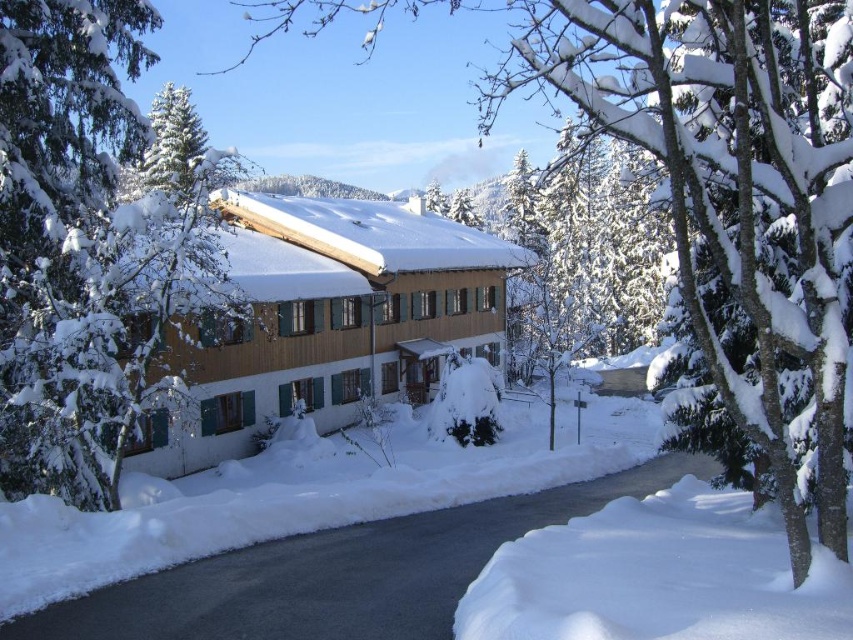
Is snow-covered tree at center behind white fluffy snow at lower right?

Yes, it is behind white fluffy snow at lower right.

Between snow-covered tree at center and white fluffy snow at lower right, which one has less height?

Standing shorter between the two is white fluffy snow at lower right.

Is point (720, 58) more distant than point (741, 509)?

No, it is in front of (741, 509).

Find the location of `snow-covered tree at center`. snow-covered tree at center is located at coordinates (727, 193).

Between point (126, 365) and point (711, 516), which one is positioned in front?

Point (711, 516) is in front.

This screenshot has height=640, width=853. Identify the location of green matte tree at left. (86, 244).

Between point (80, 168) and point (730, 577), which one is positioned in front?

Point (730, 577) is more forward.

Locate an element on the screen. This screenshot has height=640, width=853. green matte tree at left is located at coordinates (86, 244).

Is snow-covered tree at center shorter than green matte tree at left?

No, snow-covered tree at center is not shorter than green matte tree at left.

Identify the location of snow-covered tree at center. (727, 193).